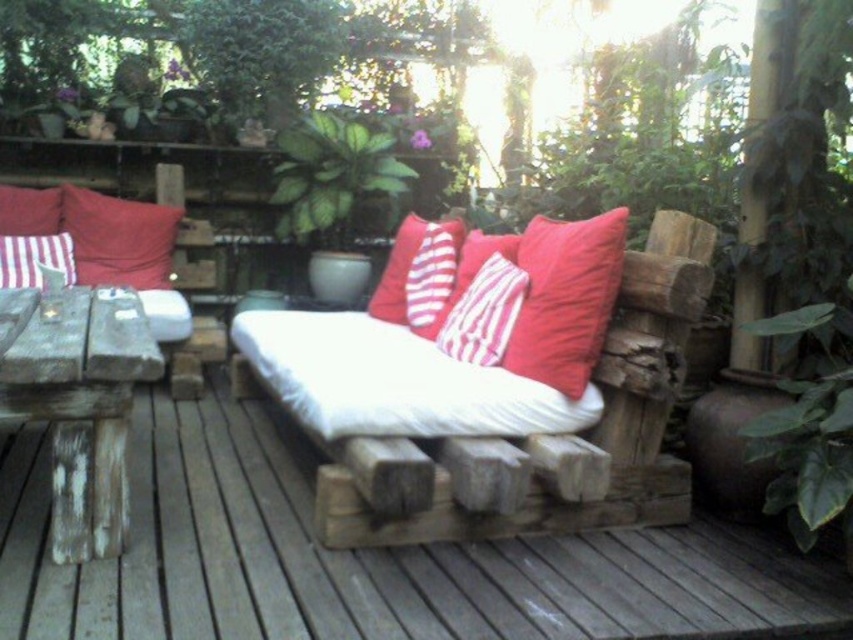
Does weathered wood table at left have a greater width compared to red striped cushion at center?

Indeed, weathered wood table at left has a greater width compared to red striped cushion at center.

Which is below, weathered wood table at left or red striped cushion at center?

weathered wood table at left is lower down.

Locate an element on the screen. This screenshot has width=853, height=640. weathered wood table at left is located at coordinates click(x=82, y=408).

You are a GUI agent. You are given a task and a screenshot of the screen. Output one action in this format:
    pyautogui.click(x=<x>, y=<y>)
    Task: Click on the weathered wood table at left
    
    Given the screenshot: What is the action you would take?
    pyautogui.click(x=82, y=408)

Who is positioned more to the right, green leafy plant at lower right or matte red pillow at left?

green leafy plant at lower right

Which is behind, point (805, 513) or point (22, 225)?

Point (22, 225)

Locate an element on the screen. This screenshot has height=640, width=853. green leafy plant at lower right is located at coordinates (809, 426).

What do you see at coordinates (82, 408) in the screenshot?
I see `weathered wood table at left` at bounding box center [82, 408].

Which of these two, weathered wood table at left or red cotton cushion at center, stands taller?

With more height is weathered wood table at left.

Identify the location of weathered wood table at left. This screenshot has width=853, height=640. (82, 408).